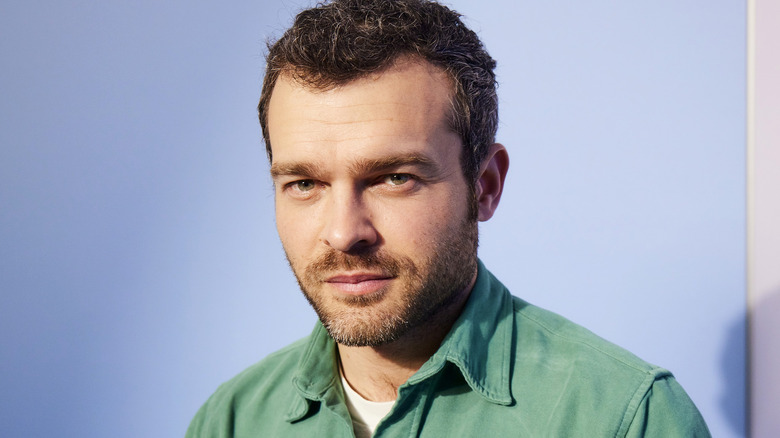
Where is `wall`? The image size is (780, 438). wall is located at coordinates (190, 221).